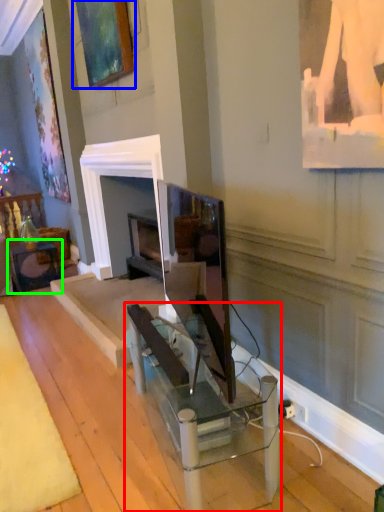
Question: Estimate the real-world distances between objects in this image. Which object is closer to table (highlighted by a red box), picture frame (highlighted by a blue box) or table (highlighted by a green box)?

Choices:
 (A) picture frame
 (B) table

Answer: (A)